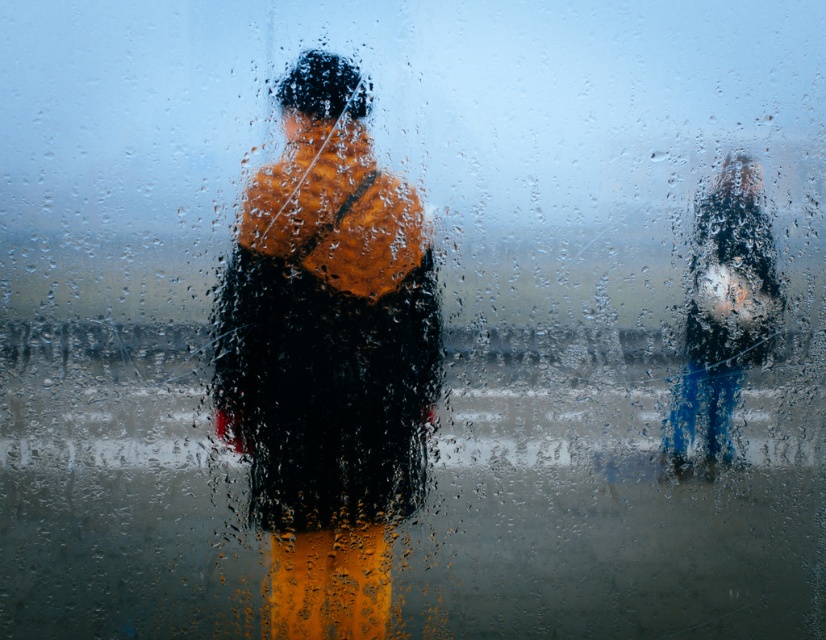
Question: Is orange fabric jacket at center behind shiny black jacket at right?

Choices:
 (A) yes
 (B) no

Answer: (B)

Question: Which point appears farthest from the camera in this image?

Choices:
 (A) (768, 349)
 (B) (354, 134)

Answer: (A)

Question: Does orange fabric jacket at center have a lesser width compared to shiny black jacket at right?

Choices:
 (A) no
 (B) yes

Answer: (A)

Question: Can you confirm if orange fabric jacket at center is positioned below shiny black jacket at right?

Choices:
 (A) no
 (B) yes

Answer: (B)